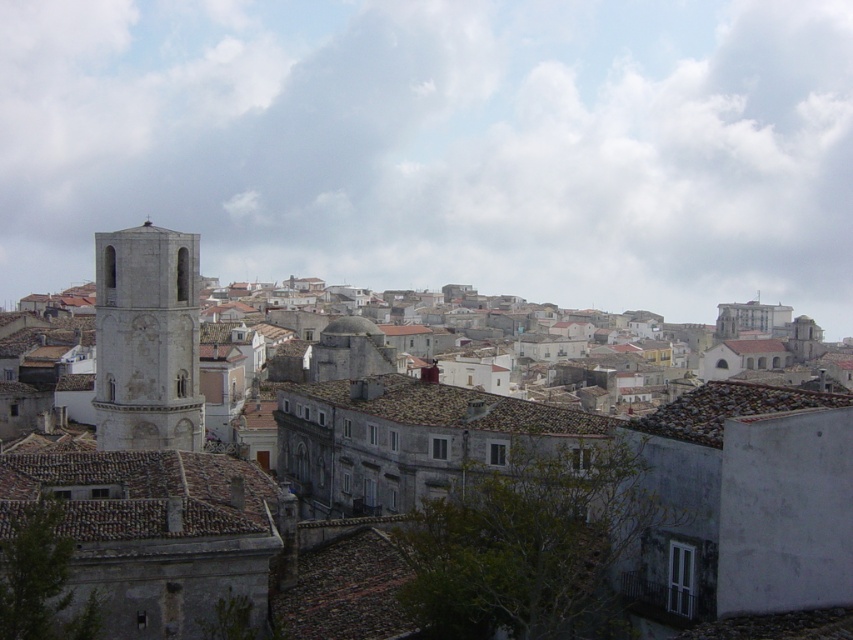
Is gray stone bell tower at left positioned behind brown tile roof at center?

Yes, it is behind brown tile roof at center.

Does gray stone bell tower at left appear on the left side of brown tile roof at center?

Yes, gray stone bell tower at left is to the left of brown tile roof at center.

Between point (129, 376) and point (444, 396), which one is positioned behind?

The point (129, 376) is more distant.

The image size is (853, 640). Identify the location of gray stone bell tower at left. (148, 339).

Does stone tower at left have a lesser height compared to gray stone bell tower at left?

No, stone tower at left is not shorter than gray stone bell tower at left.

Who is positioned more to the left, stone tower at left or gray stone bell tower at left?

gray stone bell tower at left

Between point (824, 522) and point (109, 266), which one is positioned behind?

Positioned behind is point (109, 266).

Where is `stone tower at left`? This screenshot has width=853, height=640. stone tower at left is located at coordinates (613, 476).

Who is taller, stone tower at left or brown tile roof at center?

stone tower at left is taller.

Does stone tower at left have a lesser height compared to brown tile roof at center?

No.

Where is `stone tower at left`? stone tower at left is located at coordinates [613, 476].